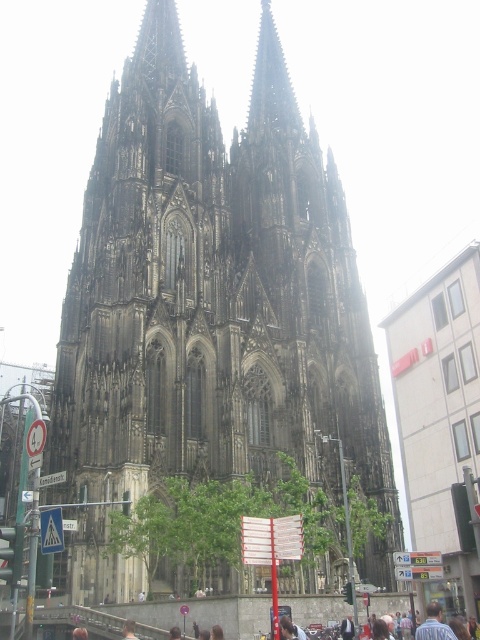
Is dark hair at lower center further to the viewer compared to brown hair at lower center?

No, it is not.

Is point (282, 621) more distant than point (123, 627)?

No, it is not.

Find the location of a particular element. The image size is (480, 640). dark hair at lower center is located at coordinates (290, 628).

Is point (428, 624) positioned in front of point (126, 627)?

Yes, point (428, 624) is in front of point (126, 627).

What are the coordinates of `blue shirt at center` in the screenshot? It's located at (433, 625).

Which is below, dark stone tower at center or blue shirt at center?

blue shirt at center is lower down.

Is dark stone tower at center above blue shirt at center?

Yes, dark stone tower at center is above blue shirt at center.

Who is more distant from viewer, (263, 150) or (435, 625)?

Positioned behind is point (263, 150).

What are the coordinates of `dark stone tower at center` in the screenshot? It's located at (216, 296).